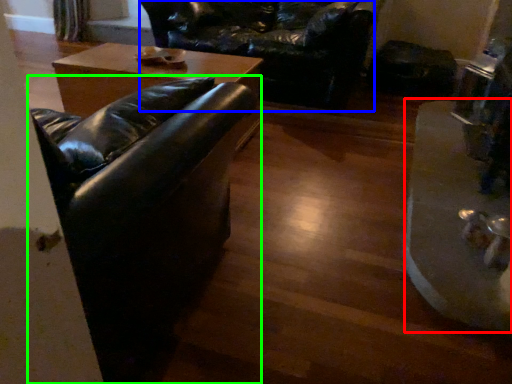
Question: Considering the real-world distances, which object is closest to wide (highlighted by a red box)? swivel chair (highlighted by a blue box) or studio couch (highlighted by a green box).

Choices:
 (A) swivel chair
 (B) studio couch

Answer: (B)